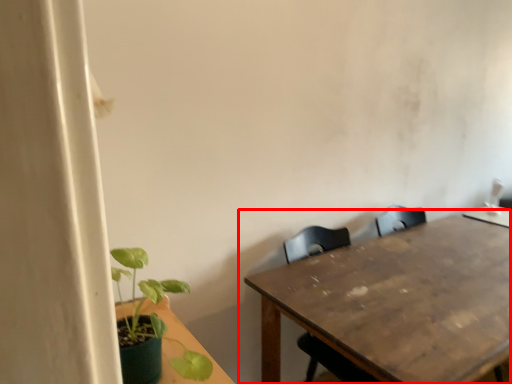
Question: In this image, where is table (annotated by the red box) located relative to houseplant?

Choices:
 (A) left
 (B) right

Answer: (B)